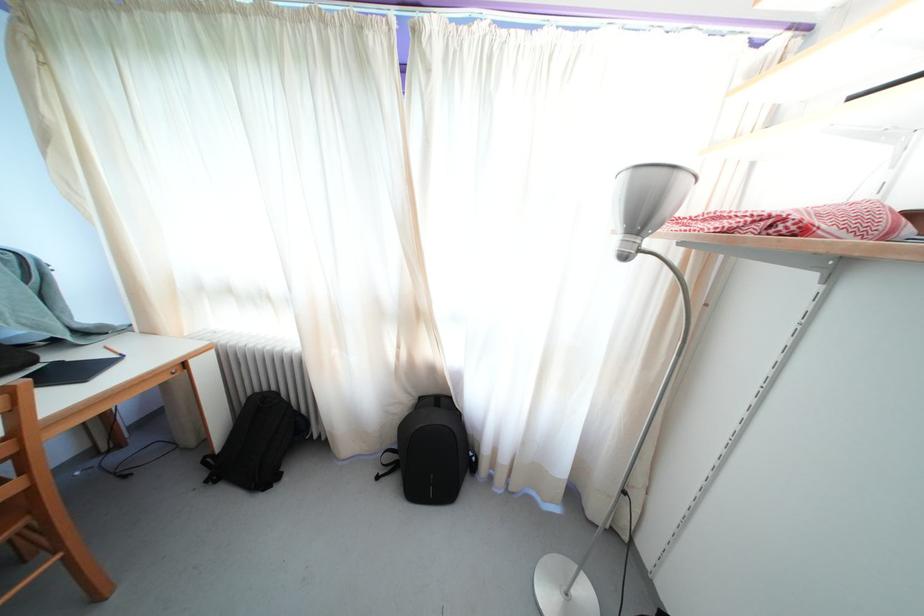
Locate an element on the screen. This screenshot has height=616, width=924. orange pencil is located at coordinates (114, 351).